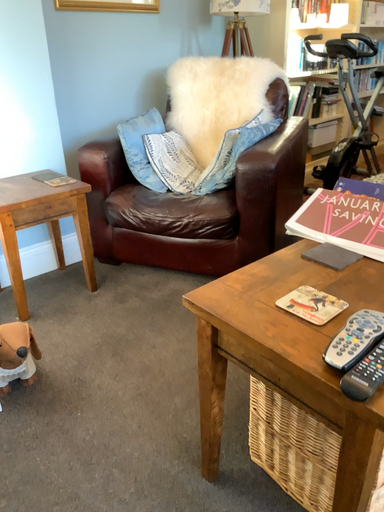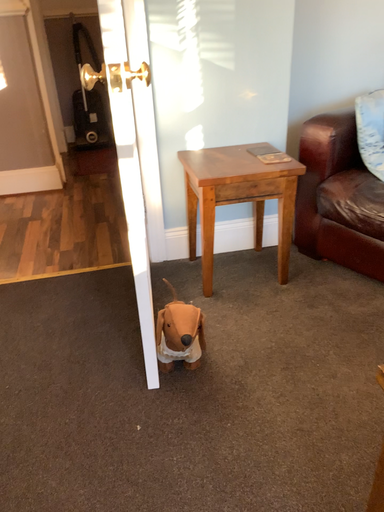
Question: Which way did the camera rotate in the video?

Choices:
 (A) rotated right
 (B) rotated left

Answer: (B)